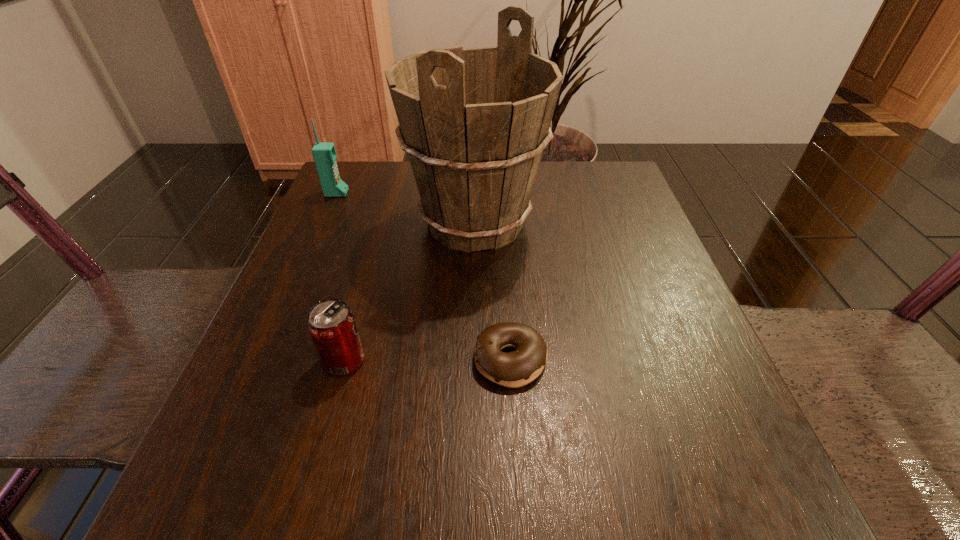
Find the location of a particular element. The height and width of the screenshot is (540, 960). the tallest object is located at coordinates (474, 122).

At what (x,y) coordinates should I click in order to perform the action: click on cellular telephone. Please return your answer as a coordinate pair (x, y). The height and width of the screenshot is (540, 960). Looking at the image, I should click on (324, 153).

Identify the location of the leftmost object. The image size is (960, 540). (324, 153).

Find the location of `pop soda`. pop soda is located at coordinates (331, 324).

Locate an element on the screen. the second shortest object is located at coordinates (331, 324).

You are a GUI agent. You are given a task and a screenshot of the screen. Output one action in this format:
    pyautogui.click(x=<x>, y=<y>)
    Task: Click on the doughnut
    
    Given the screenshot: What is the action you would take?
    pyautogui.click(x=515, y=369)

Locate an element on the screen. free space located 0.080m on the right of the tallest object is located at coordinates (580, 223).

Locate an element on the screen. Image resolution: width=960 pixels, height=540 pixels. vacant space located on the keypad of the cellular telephone is located at coordinates (381, 193).

This screenshot has width=960, height=540. Find the location of `vacant position located 0.060m on the front of the second object from left to right`. vacant position located 0.060m on the front of the second object from left to right is located at coordinates (329, 414).

Identify the location of free location located on the front of the doughnut. This screenshot has height=540, width=960. (515, 428).